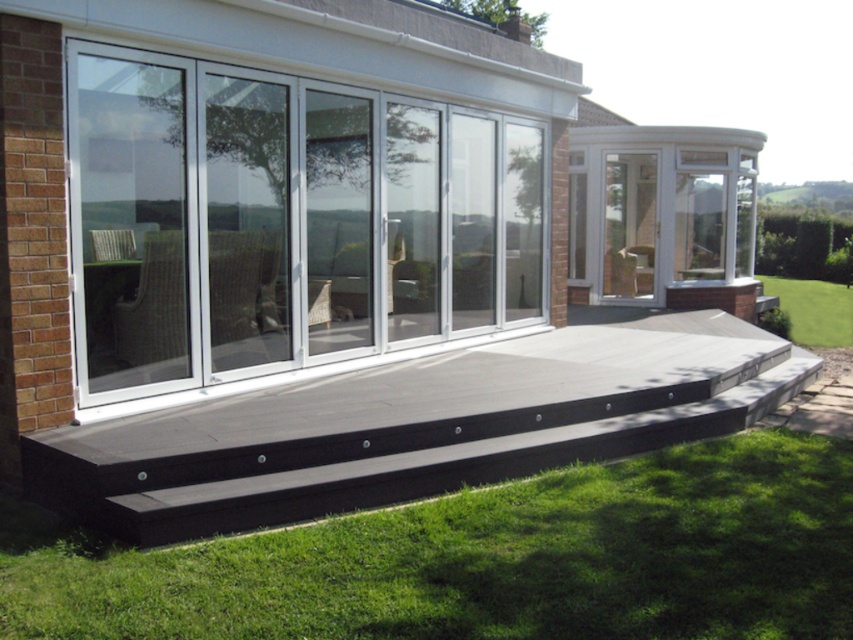
Question: Which object is the farthest from the black wood deck at center?

Choices:
 (A) clear glass door at center
 (B) white aluminum sliding door at center
 (C) green grass at lower right
 (D) green grass at lower center

Answer: (C)

Question: Does green grass at lower center have a smaller size compared to clear glass door at center?

Choices:
 (A) no
 (B) yes

Answer: (B)

Question: Is green grass at lower center thinner than black wood deck at center?

Choices:
 (A) no
 (B) yes

Answer: (A)

Question: Which of the following is the closest to the observer?

Choices:
 (A) (651, 236)
 (B) (88, 595)

Answer: (B)

Question: Does clear glass door at center appear over green grass at lower right?

Choices:
 (A) no
 (B) yes

Answer: (B)

Question: Which object appears farthest from the camera in this image?

Choices:
 (A) black wood deck at center
 (B) green grass at lower right
 (C) clear glass door at center

Answer: (B)